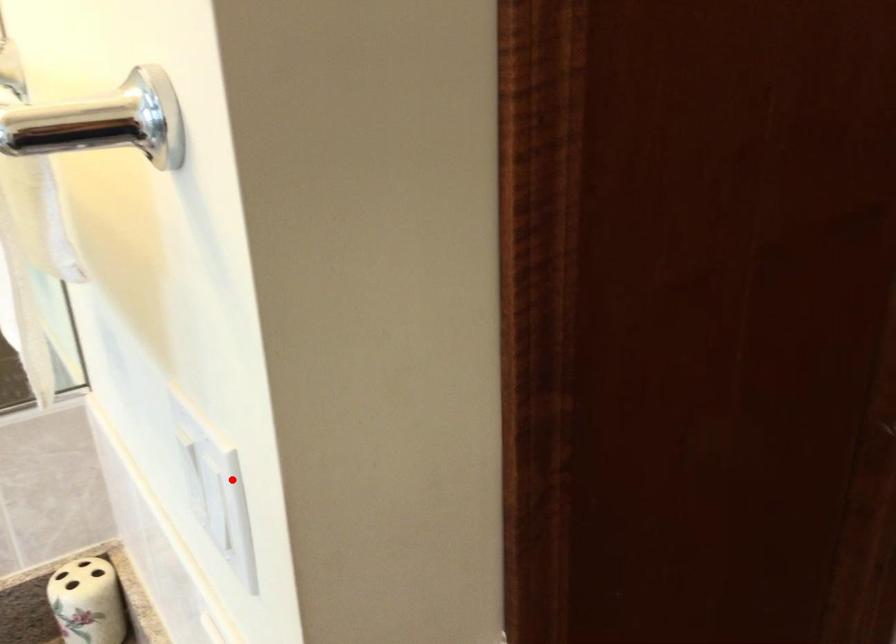
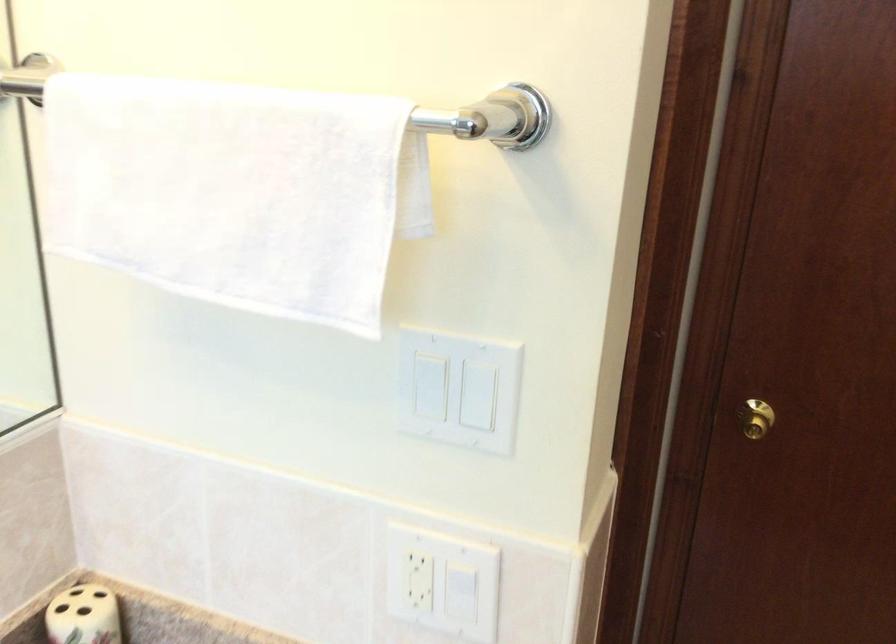
In the second image, find the point that corresponds to the highlighted location in the first image.

(458, 389)